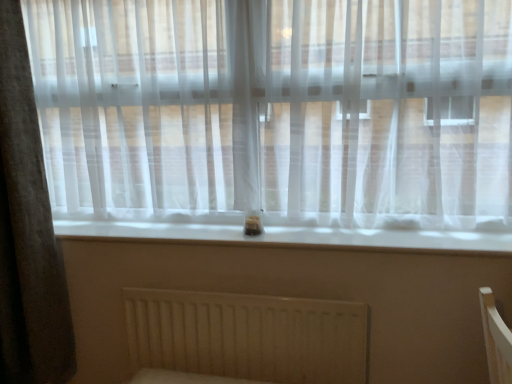
Question: Is white smooth window sill at center spatially inside white matte radiator at lower center, or outside of it?

Choices:
 (A) outside
 (B) inside

Answer: (A)

Question: Considering their positions, is white smooth window sill at center located in front of or behind white matte radiator at lower center?

Choices:
 (A) front
 (B) behind

Answer: (A)

Question: Which object is the farthest from the white matte radiator at lower center?

Choices:
 (A) white smooth window sill at center
 (B) gray fabric curtain at left

Answer: (B)

Question: Considering the real-world distances, which object is closest to the white matte radiator at lower center?

Choices:
 (A) white smooth window sill at center
 (B) gray fabric curtain at left

Answer: (A)